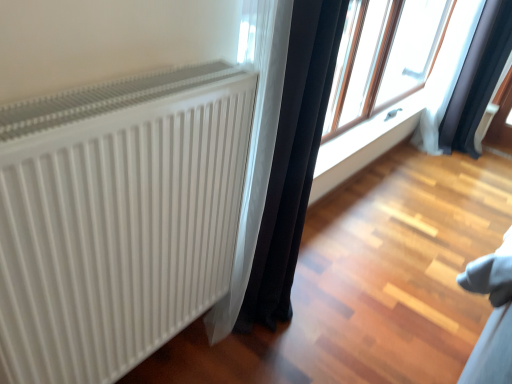
What are the coordinates of `black fabric curtain at upper right, which ranks as the 1th curtain in back-to-front order` in the screenshot? It's located at (466, 78).

What do you see at coordinates (117, 218) in the screenshot? Image resolution: width=512 pixels, height=384 pixels. I see `white ribbed radiator at left` at bounding box center [117, 218].

Find the location of `black fabric curtain at upper right, the 2th curtain in the left-to-right sequence`. black fabric curtain at upper right, the 2th curtain in the left-to-right sequence is located at coordinates (466, 78).

Is white smooth window sill at center beside transparent glass window at upper right?

No, white smooth window sill at center is not next to transparent glass window at upper right.

Does white smooth window sill at center come behind transparent glass window at upper right?

Yes, white smooth window sill at center is further from the viewer.

How far apart are white smooth window sill at center and transparent glass window at upper right?

white smooth window sill at center is 30.91 centimeters from transparent glass window at upper right.

Between point (320, 162) and point (359, 66), which one is positioned in front?

The point (320, 162) is closer to the camera.

Considering the sizes of objects transparent glass window at upper right and black fabric curtain at center, marked as the second curtain in a right-to-left arrangement, in the image provided, who is bigger, transparent glass window at upper right or black fabric curtain at center, marked as the second curtain in a right-to-left arrangement,?

transparent glass window at upper right is bigger.

Is black fabric curtain at center, marked as the second curtain in a right-to-left arrangement, surrounded by transparent glass window at upper right?

That's incorrect, black fabric curtain at center, marked as the second curtain in a right-to-left arrangement, is not inside transparent glass window at upper right.

Which is more to the right, transparent glass window at upper right or black fabric curtain at center, marked as the second curtain in a right-to-left arrangement?

From the viewer's perspective, transparent glass window at upper right appears more on the right side.

From a real-world perspective, which is physically below, transparent glass window at upper right or black fabric curtain at center, the second curtain from the back?

black fabric curtain at center, the second curtain from the back, is physically lower.

Does black fabric curtain at upper right, the 1th curtain positioned from the right, appear on the left side of black fabric curtain at center, acting as the first curtain starting from the front?

No, black fabric curtain at upper right, the 1th curtain positioned from the right, is not to the left of black fabric curtain at center, acting as the first curtain starting from the front.

From a real-world perspective, is black fabric curtain at upper right, positioned as the second curtain in front-to-back order, positioned above or below black fabric curtain at center, the second curtain from the back?

Clearly, from a real-world perspective, black fabric curtain at upper right, positioned as the second curtain in front-to-back order, is below black fabric curtain at center, the second curtain from the back.

In the image, there is a black fabric curtain at center, marked as the second curtain in a right-to-left arrangement. Identify the location of curtain below it (from a real-world perspective). (466, 78).

Does white ribbed radiator at left turn towards black fabric curtain at center, acting as the first curtain starting from the left?

No.

Which is behind, white ribbed radiator at left or black fabric curtain at center, acting as the first curtain starting from the left?

Positioned behind is black fabric curtain at center, acting as the first curtain starting from the left.

Looking at this image, is white ribbed radiator at left inside the boundaries of black fabric curtain at center, acting as the first curtain starting from the front, or outside?

The correct answer is: outside.

Is black fabric curtain at upper right, positioned as the second curtain in front-to-back order, further to camera compared to transparent glass window at upper right?

Yes, the depth of black fabric curtain at upper right, positioned as the second curtain in front-to-back order, is greater than that of transparent glass window at upper right.

Can you confirm if black fabric curtain at upper right, the 2th curtain in the left-to-right sequence, is positioned to the right of transparent glass window at upper right?

Indeed, black fabric curtain at upper right, the 2th curtain in the left-to-right sequence, is positioned on the right side of transparent glass window at upper right.

From a real-world perspective, which is physically below, black fabric curtain at upper right, positioned as the second curtain in front-to-back order, or transparent glass window at upper right?

black fabric curtain at upper right, positioned as the second curtain in front-to-back order.

Considering the relative sizes of black fabric curtain at upper right, positioned as the second curtain in front-to-back order, and transparent glass window at upper right in the image provided, is black fabric curtain at upper right, positioned as the second curtain in front-to-back order, shorter than transparent glass window at upper right?

In fact, black fabric curtain at upper right, positioned as the second curtain in front-to-back order, may be taller than transparent glass window at upper right.

Is transparent glass window at upper right at the right side of black fabric curtain at upper right, positioned as the second curtain in front-to-back order?

In fact, transparent glass window at upper right is to the left of black fabric curtain at upper right, positioned as the second curtain in front-to-back order.

Can you tell me how much transparent glass window at upper right and black fabric curtain at upper right, positioned as the second curtain in front-to-back order, differ in facing direction?

0.521 degrees.

Looking at this image, is transparent glass window at upper right far from black fabric curtain at upper right, which ranks as the 1th curtain in back-to-front order?

transparent glass window at upper right is actually quite close to black fabric curtain at upper right, which ranks as the 1th curtain in back-to-front order.

Who is bigger, transparent glass window at upper right or black fabric curtain at upper right, the 1th curtain positioned from the right?

With larger size is transparent glass window at upper right.

Considering the relative positions of transparent glass window at upper right and white smooth window sill at center in the image provided, is transparent glass window at upper right to the left of white smooth window sill at center from the viewer's perspective?

No.

This screenshot has width=512, height=384. Identify the location of window located above the white smooth window sill at center (from the image's perspective). (384, 58).

Which is nearer, (338, 82) or (320, 169)?

Positioned in front is point (320, 169).

Which object is further away from the camera, transparent glass window at upper right or white smooth window sill at center?

white smooth window sill at center.

Where is `window sill located underneath the transparent glass window at upper right (from a real-world perspective)`? Image resolution: width=512 pixels, height=384 pixels. window sill located underneath the transparent glass window at upper right (from a real-world perspective) is located at coordinates (368, 138).

You are a GUI agent. You are given a task and a screenshot of the screen. Output one action in this format:
    pyautogui.click(x=<x>, y=<y>)
    Task: Click on the curtain in front of the transparent glass window at upper right
    
    Given the screenshot: What is the action you would take?
    pyautogui.click(x=293, y=160)

Based on the photo, which object lies further to the anchor point black fabric curtain at upper right, the 2th curtain in the left-to-right sequence, black fabric curtain at center, acting as the first curtain starting from the front, or white smooth window sill at center?

black fabric curtain at center, acting as the first curtain starting from the front, is positioned further to the anchor black fabric curtain at upper right, the 2th curtain in the left-to-right sequence.

Based on their spatial positions, is black fabric curtain at upper right, which ranks as the 1th curtain in back-to-front order, or white ribbed radiator at left closer to transparent glass window at upper right?

The object closer to transparent glass window at upper right is black fabric curtain at upper right, which ranks as the 1th curtain in back-to-front order.

Looking at the image, which one is located closer to transparent glass window at upper right, white ribbed radiator at left or black fabric curtain at center, marked as the second curtain in a right-to-left arrangement?

black fabric curtain at center, marked as the second curtain in a right-to-left arrangement, is closer to transparent glass window at upper right.

Estimate the real-world distances between objects in this image. Which object is further from black fabric curtain at center, the second curtain from the back, transparent glass window at upper right or black fabric curtain at upper right, the 1th curtain positioned from the right?

The object further to black fabric curtain at center, the second curtain from the back, is black fabric curtain at upper right, the 1th curtain positioned from the right.

Looking at the image, which one is located closer to transparent glass window at upper right, white ribbed radiator at left or white smooth window sill at center?

Among the two, white smooth window sill at center is located nearer to transparent glass window at upper right.

When comparing their distances from black fabric curtain at upper right, which ranks as the 1th curtain in back-to-front order, does transparent glass window at upper right or white smooth window sill at center seem closer?

Based on the image, transparent glass window at upper right appears to be nearer to black fabric curtain at upper right, which ranks as the 1th curtain in back-to-front order.

From the image, which object appears to be farther from white ribbed radiator at left, white smooth window sill at center or black fabric curtain at center, the second curtain from the back?

white smooth window sill at center lies further to white ribbed radiator at left than the other object.

Which object lies nearer to the anchor point white ribbed radiator at left, black fabric curtain at center, marked as the second curtain in a right-to-left arrangement, or black fabric curtain at upper right, the 1th curtain positioned from the right?

black fabric curtain at center, marked as the second curtain in a right-to-left arrangement, is closer to white ribbed radiator at left.

The width and height of the screenshot is (512, 384). In order to click on window between black fabric curtain at center, marked as the second curtain in a right-to-left arrangement, and white smooth window sill at center in the front-back direction in this screenshot , I will do `click(384, 58)`.

Image resolution: width=512 pixels, height=384 pixels. I want to click on window sill located between white ribbed radiator at left and black fabric curtain at upper right, positioned as the second curtain in front-to-back order, in the depth direction, so click(x=368, y=138).

This screenshot has height=384, width=512. I want to click on window sill between black fabric curtain at center, the second curtain from the back, and black fabric curtain at upper right, the 2th curtain in the left-to-right sequence, along the z-axis, so click(x=368, y=138).

Find the location of a particular element. The height and width of the screenshot is (384, 512). window sill between transparent glass window at upper right and black fabric curtain at upper right, which ranks as the 1th curtain in back-to-front order, from front to back is located at coordinates (368, 138).